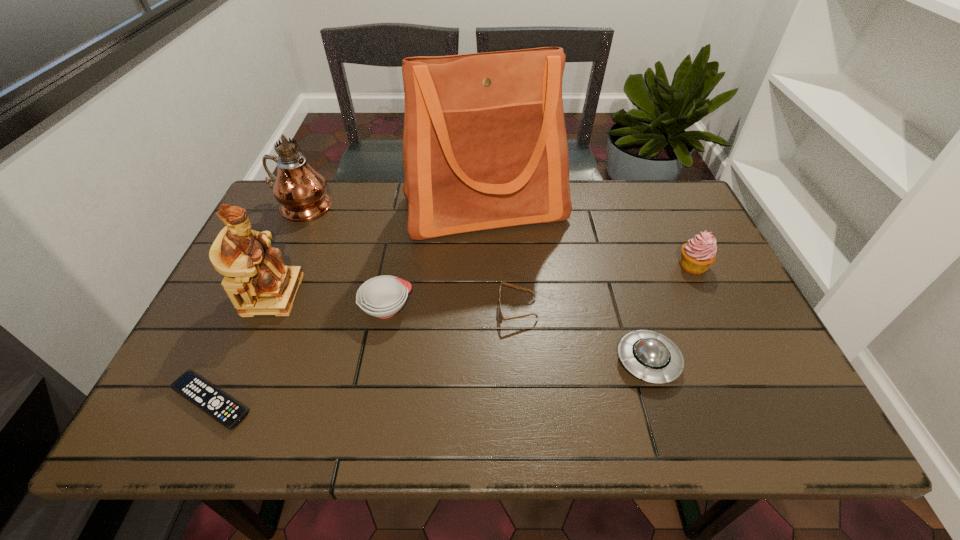
Locate an element on the screen. This screenshot has width=960, height=540. free space located 0.070m on the back of the oil lamp is located at coordinates (313, 179).

You are a GUI agent. You are given a task and a screenshot of the screen. Output one action in this format:
    pyautogui.click(x=<x>, y=<y>)
    Task: Click on the vacant region located on the front-facing side of the sixth shortest object
    The height and width of the screenshot is (540, 960).
    Given the screenshot: What is the action you would take?
    pyautogui.click(x=366, y=294)

Locate an element on the screen. vacant space situated 0.350m on the front of the cupcake is located at coordinates (757, 400).

Where is `vacant area situated 0.070m on the front of the second object from right to left`? vacant area situated 0.070m on the front of the second object from right to left is located at coordinates (666, 421).

At what (x,y) coordinates should I click in order to perform the action: click on free space located 0.120m on the left of the soup bowl. Please return your answer as a coordinate pair (x, y). This screenshot has height=540, width=960. Looking at the image, I should click on (311, 308).

Where is `vacant space located on the frames of the sunglasses`? vacant space located on the frames of the sunglasses is located at coordinates (456, 309).

The height and width of the screenshot is (540, 960). I want to click on blank space located 0.110m on the frames of the sunglasses, so click(452, 309).

The width and height of the screenshot is (960, 540). I want to click on vacant space located on the frames of the sunglasses, so click(448, 309).

This screenshot has width=960, height=540. Find the location of `free space located 0.260m on the back of the remote control`. free space located 0.260m on the back of the remote control is located at coordinates (265, 285).

Find the location of a particular element. The height and width of the screenshot is (540, 960). shopping bag that is at the far edge is located at coordinates (484, 143).